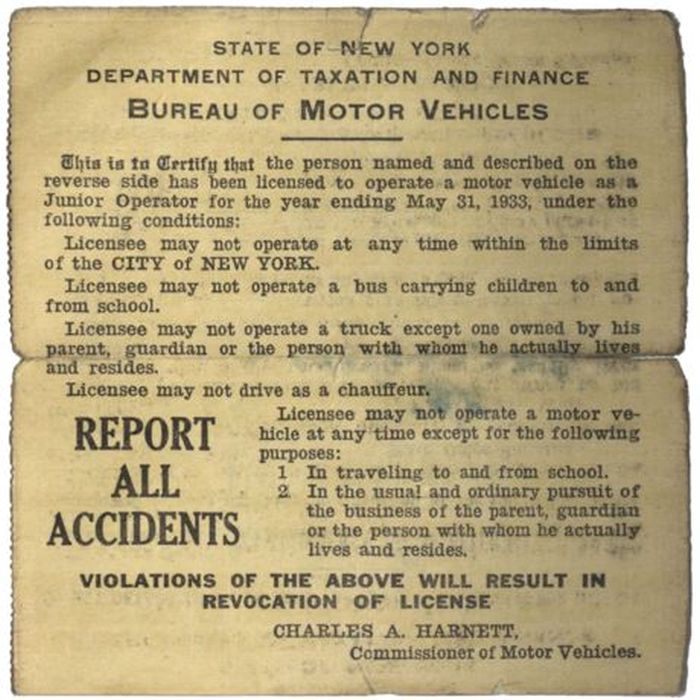
Find the location of a particular element. This screenshot has width=700, height=700. newspaper old is located at coordinates (351, 304).